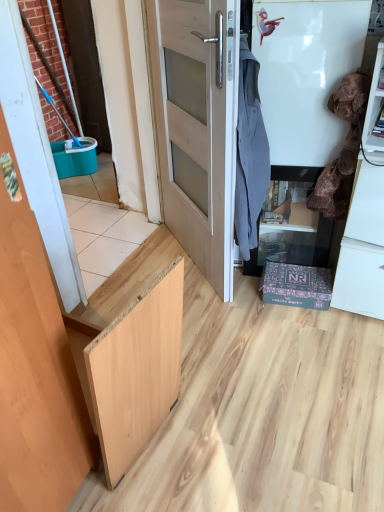
Locate an element on the screen. Image resolution: width=384 pixels, height=512 pixels. vacant area situated below gray fabric shirt at upper right, acting as the 1th laundry starting from the left (from a real-world perspective) is located at coordinates (249, 294).